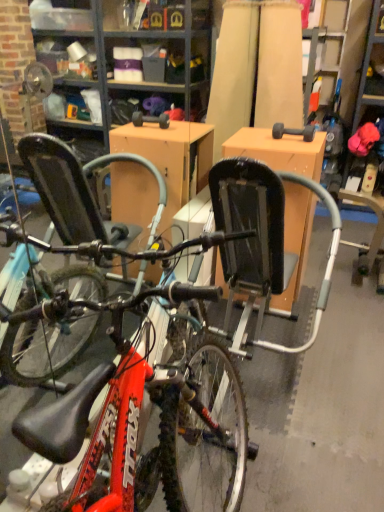
The height and width of the screenshot is (512, 384). What do you see at coordinates (140, 403) in the screenshot?
I see `red matte bicycle at center` at bounding box center [140, 403].

I want to click on red matte bicycle at center, so click(x=140, y=403).

At what (x,y) coordinates should I click in order to perform the action: click on red matte bicycle at center. Please return your answer as a coordinate pair (x, y). The width and height of the screenshot is (384, 512). Looking at the image, I should click on (140, 403).